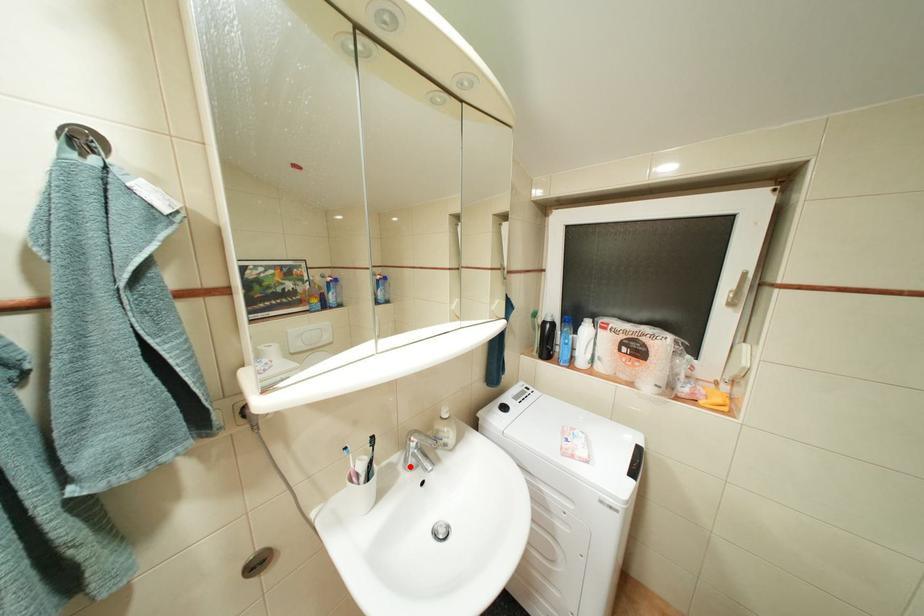
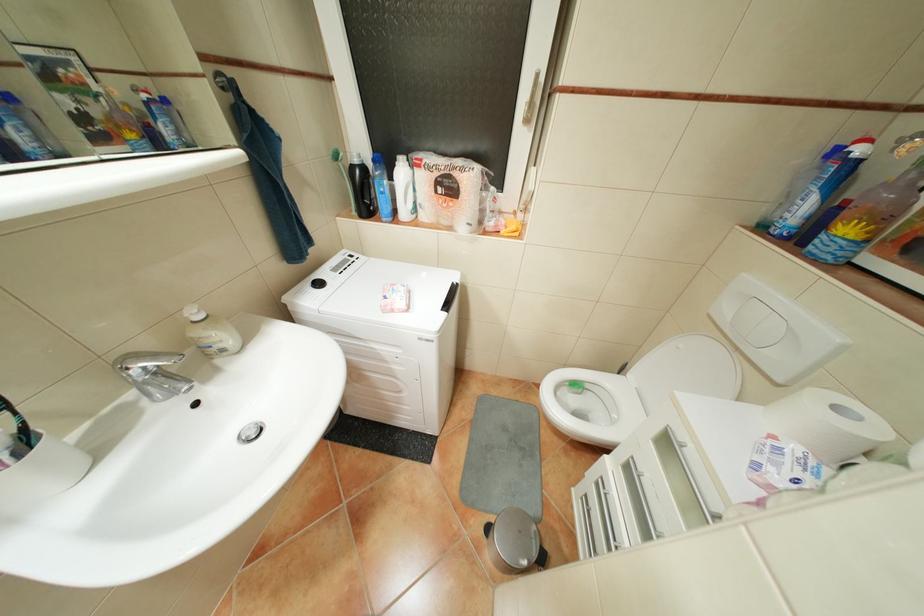
Question: I am providing you with two images of the same scene from different viewpoints. Given a red point in image1, look at the same physical point in image2. Is it:

Choices:
 (A) Closer to the viewpoint
 (B) Farther from the viewpoint

Answer: (A)